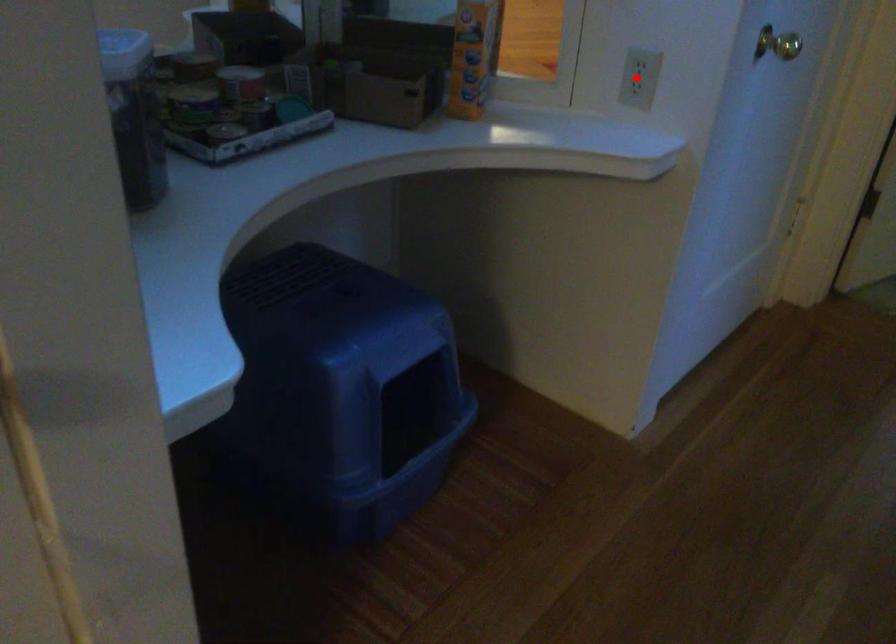
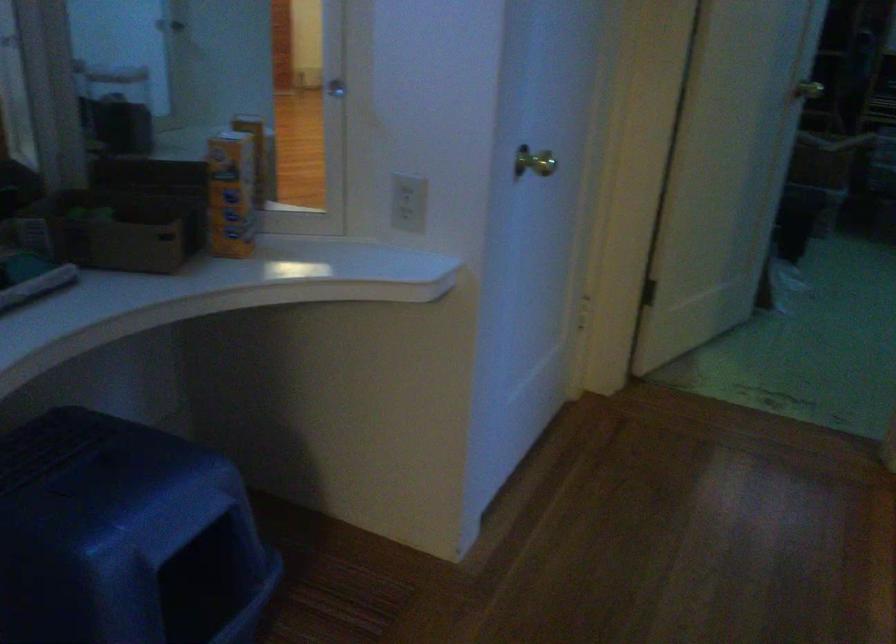
Where in the second image is the point corresponding to the highlighted location from the first image?

(409, 202)